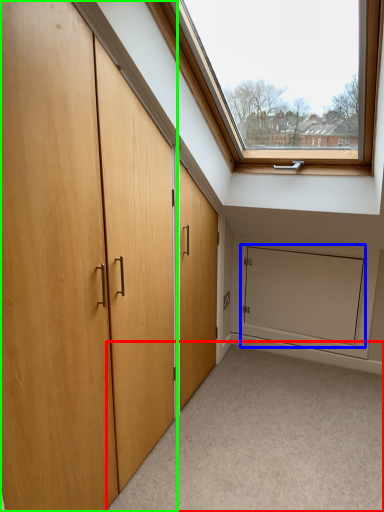
Question: Which object is positioned closest to corridor (highlighted by a red box)? Select from screen door (highlighted by a blue box) and door (highlighted by a green box).

Choices:
 (A) screen door
 (B) door

Answer: (A)